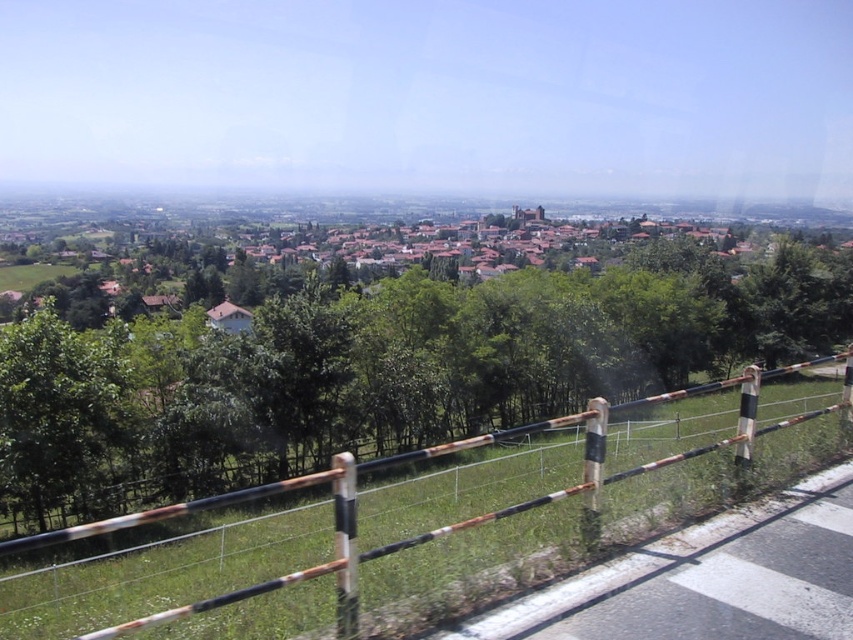
Question: Which of the following is the closest to the observer?

Choices:
 (A) (421, 240)
 (B) (334, 621)
 (C) (129, 497)

Answer: (B)

Question: Is green leafy tree at center to the left of rusty metal fence at lower right from the viewer's perspective?

Choices:
 (A) yes
 (B) no

Answer: (B)

Question: Is the position of rusty metal fence at lower right less distant than that of brown tiled roofs at center?

Choices:
 (A) no
 (B) yes

Answer: (B)

Question: Which point is closer to the camera taking this photo?

Choices:
 (A) (160, 298)
 (B) (608, 502)
 (C) (393, 417)

Answer: (B)

Question: Which object is positioned closest to the rusty metal fence at lower right?

Choices:
 (A) green leafy tree at center
 (B) brown tiled roofs at center

Answer: (A)

Question: Does rusty metal fence at lower right appear on the right side of brown tiled roofs at center?

Choices:
 (A) no
 (B) yes

Answer: (B)